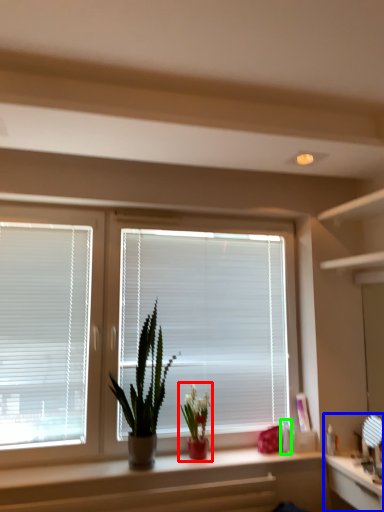
Question: Considering the real-world distances, which object is closest to houseplant (highlighted by a red box)? computer (highlighted by a blue box) or toiletry (highlighted by a green box).

Choices:
 (A) computer
 (B) toiletry

Answer: (B)